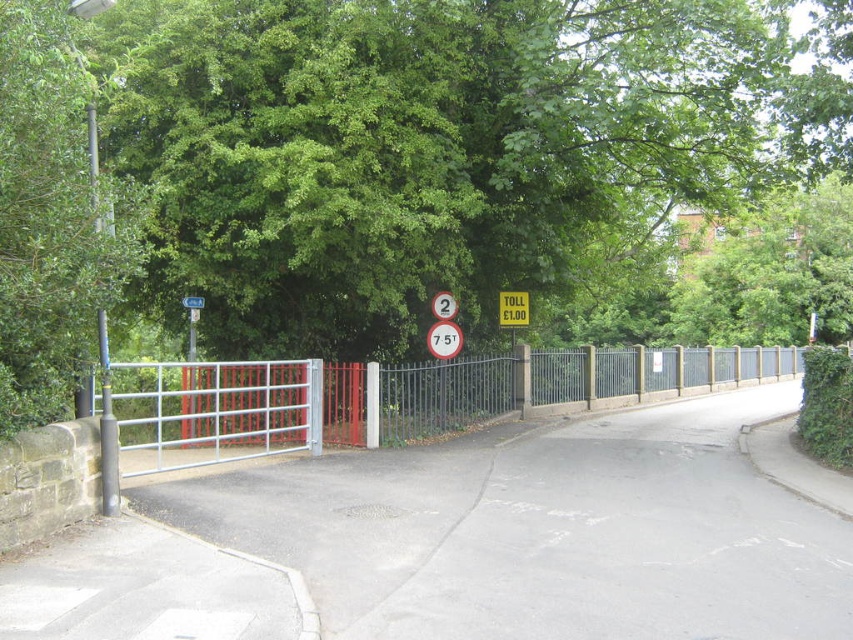
Question: Does metallic gate at center appear on the left side of yellow matte toll sign at center?

Choices:
 (A) no
 (B) yes

Answer: (A)

Question: Which object is farther from the camera taking this photo?

Choices:
 (A) green plastic sign at upper center
 (B) metallic gate at center
 (C) metallic circular sign at center

Answer: (C)

Question: Is green leafy tree at upper center behind green plastic sign at upper center?

Choices:
 (A) yes
 (B) no

Answer: (B)

Question: Which point is closer to the camera?

Choices:
 (A) metallic circular sign at center
 (B) yellow matte toll sign at center

Answer: (A)

Question: Which object is positioned farthest from the yellow matte toll sign at center?

Choices:
 (A) green plastic sign at upper center
 (B) green leafy tree at upper center

Answer: (A)

Question: Can you confirm if yellow matte toll sign at center is bigger than red plastic sign at center?

Choices:
 (A) no
 (B) yes

Answer: (B)